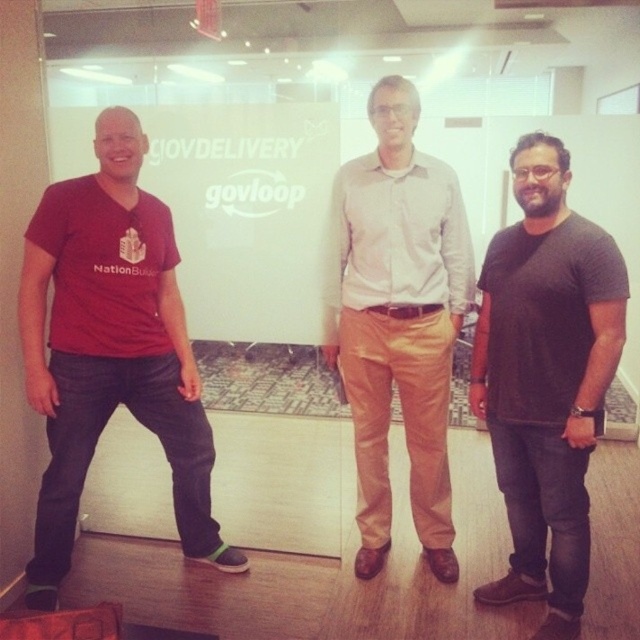
Can you confirm if matte red t-shirt at left is taller than light brown cotton pants at center?

Incorrect, matte red t-shirt at left's height is not larger of light brown cotton pants at center's.

Between matte red t-shirt at left and light brown cotton pants at center, which one appears on the left side from the viewer's perspective?

Positioned to the left is matte red t-shirt at left.

Between point (134, 208) and point (392, 241), which one is positioned in front?

Point (134, 208) is in front.

You are a GUI agent. You are given a task and a screenshot of the screen. Output one action in this format:
    pyautogui.click(x=<x>, y=<y>)
    Task: Click on the matte red t-shirt at left
    
    Given the screenshot: What is the action you would take?
    (109, 348)

Where is `dark gray t-shirt at center`? The image size is (640, 640). dark gray t-shirt at center is located at coordinates (547, 378).

Is point (508, 273) closer to viewer compared to point (445, 314)?

Yes, point (508, 273) is in front of point (445, 314).

Does point (504, 499) come in front of point (365, 369)?

Yes, point (504, 499) is closer to viewer.

I want to click on dark gray t-shirt at center, so click(x=547, y=378).

Find the location of a particular element. This screenshot has height=640, width=640. matte red t-shirt at left is located at coordinates (109, 348).

Between point (42, 584) and point (568, 637), which one is positioned in front?

Point (568, 637) is more forward.

Which is behind, point (184, 406) or point (536, 484)?

The point (184, 406) is more distant.

What are the coordinates of `matte red t-shirt at left` in the screenshot? It's located at (109, 348).